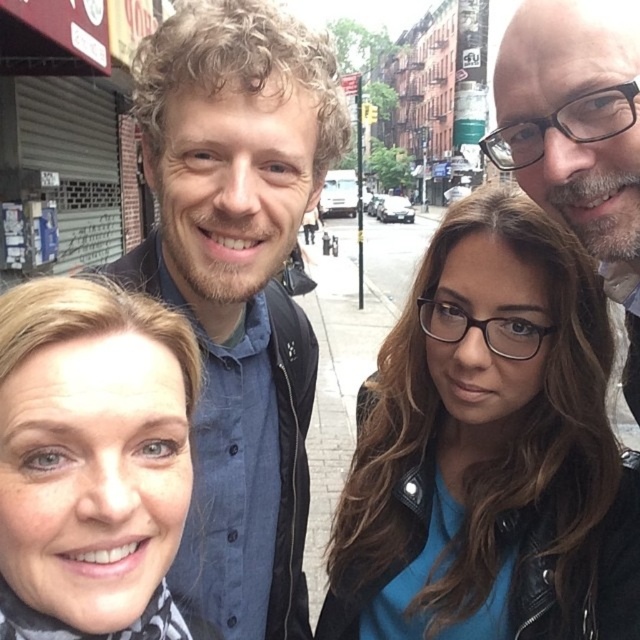
From the picture: You are standing at the edge of the street and want to greet both the person wearing the blue matte jacket at center and the person wearing the blue denim shirt at center. If you walk straight towards them, which one will you reach first?

The blue matte jacket at center and blue denim shirt at center are both at center, so you will reach them at the same time.

You are a fashion designer observing the scene. You need to create a new collection that emphasizes proportions. Which object in the scene has a greater width between the blue matte jacket at center and the matte black scarf at lower left?

The blue matte jacket at center has a greater width than the matte black scarf at lower left according to the description.